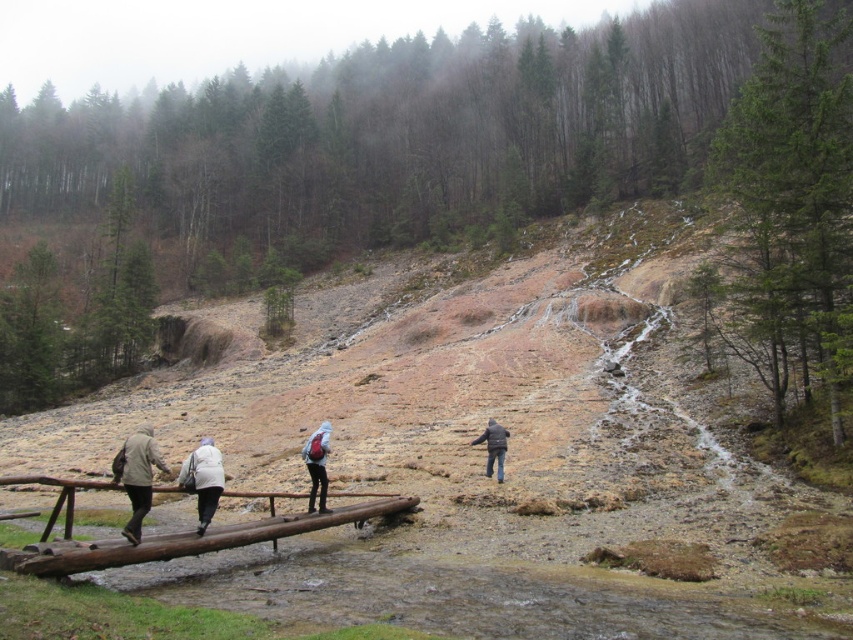
Who is more forward, (143, 467) or (495, 435)?

Point (143, 467) is more forward.

You are a GUI agent. You are given a task and a screenshot of the screen. Output one action in this format:
    pyautogui.click(x=<x>, y=<y>)
    Task: Click on the light brown leather jacket at lower left
    Image resolution: width=853 pixels, height=640 pixels.
    Given the screenshot: What is the action you would take?
    pyautogui.click(x=138, y=476)

Between light brown leather jacket at lower left and white woolen jacket at center, which one appears on the right side from the viewer's perspective?

Positioned to the right is white woolen jacket at center.

Between point (128, 474) and point (198, 481), which one is positioned behind?

The point (198, 481) is behind.

At what (x,y) coordinates should I click in order to perform the action: click on light brown leather jacket at lower left. Please return your answer as a coordinate pair (x, y). Looking at the image, I should click on (x=138, y=476).

The image size is (853, 640). Describe the element at coordinates (317, 465) in the screenshot. I see `matte black backpack at center` at that location.

Is matte black backpack at center positioned behind dark brown leather jacket at center?

That is False.

Which is behind, point (310, 458) or point (497, 433)?

Point (497, 433)

What are the coordinates of `matte black backpack at center` in the screenshot? It's located at (317, 465).